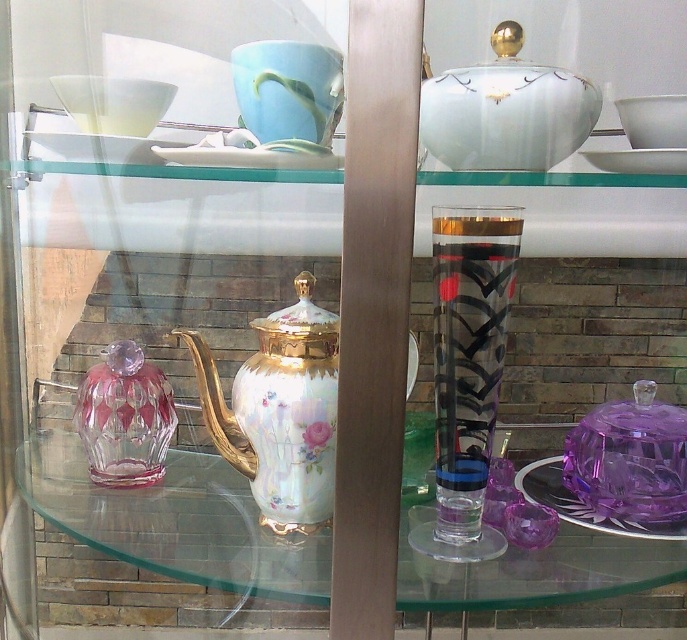
Question: Does porcelain/hand-painted teapot at center appear under translucent black and white vase at center?

Choices:
 (A) yes
 (B) no

Answer: (A)

Question: Among these points, which one is farthest from the camera?

Choices:
 (A) (449, 248)
 (B) (302, 406)
 (C) (155, 384)

Answer: (C)

Question: Which of these objects is positioned closest to the white glossy bowl at upper right?

Choices:
 (A) transparent glass table at center
 (B) translucent black and white vase at center
 (C) transparent glass bowl at upper left

Answer: (B)

Question: Observing the image, what is the correct spatial positioning of ruby crystal vase at left in reference to transparent glass bowl at upper left?

Choices:
 (A) above
 (B) below

Answer: (B)

Question: Based on their relative distances, which object is farther from the ruby crystal vase at left?

Choices:
 (A) transparent glass table at center
 (B) transparent glass bowl at upper left
 (C) porcelain/hand-painted teapot at center

Answer: (B)

Question: Is ruby crystal vase at left in front of white glossy bowl at upper right?

Choices:
 (A) yes
 (B) no

Answer: (B)